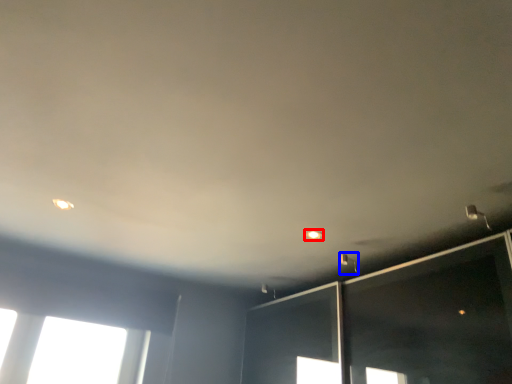
Question: Which point is closer to the camera, dot (highlighted by a red box) or light fixture (highlighted by a blue box)?

Choices:
 (A) dot
 (B) light fixture

Answer: (A)